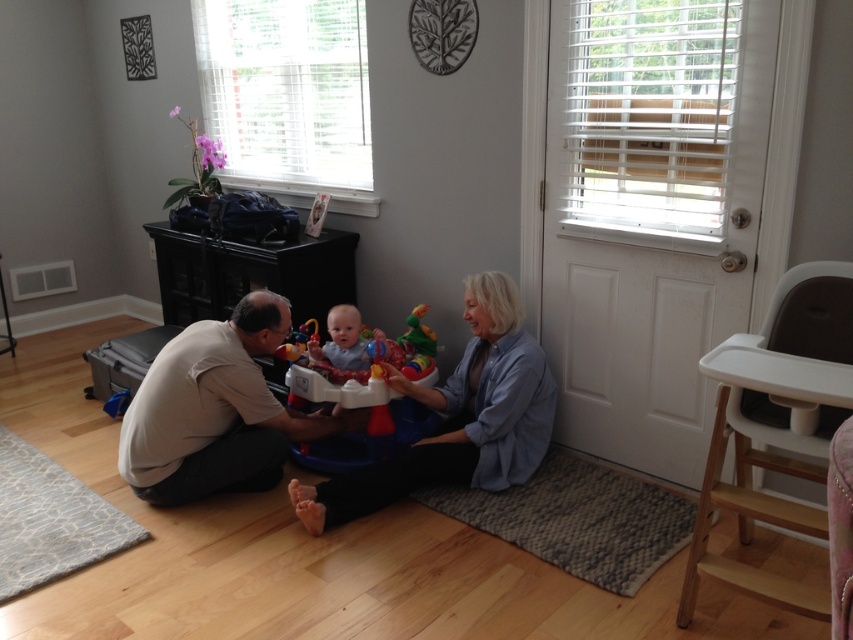
Is white plastic high chair at right above blue cotton shirt at center?

Yes.

Between point (775, 412) and point (495, 292), which one is positioned in front?

Point (775, 412) is more forward.

Is point (756, 408) farther from viewer compared to point (521, 419)?

No, (756, 408) is closer to viewer.

Identify the location of white plastic high chair at right. (776, 426).

Who is taller, blue cotton shirt at center or plastic colorful walker at center?

blue cotton shirt at center

Who is positioned more to the left, blue cotton shirt at center or plastic colorful walker at center?

plastic colorful walker at center

Is point (508, 332) closer to viewer compared to point (383, 429)?

No.

Where is `blue cotton shirt at center`? The height and width of the screenshot is (640, 853). blue cotton shirt at center is located at coordinates (457, 419).

Can you confirm if white plastic high chair at right is shorter than blue soft baby walker at center?

In fact, white plastic high chair at right may be taller than blue soft baby walker at center.

Can you confirm if white plastic high chair at right is bigger than blue soft baby walker at center?

Correct, white plastic high chair at right is larger in size than blue soft baby walker at center.

Who is more distant from viewer, (746, 412) or (344, 356)?

The point (344, 356) is behind.

This screenshot has height=640, width=853. In order to click on white plastic high chair at right in this screenshot , I will do `click(776, 426)`.